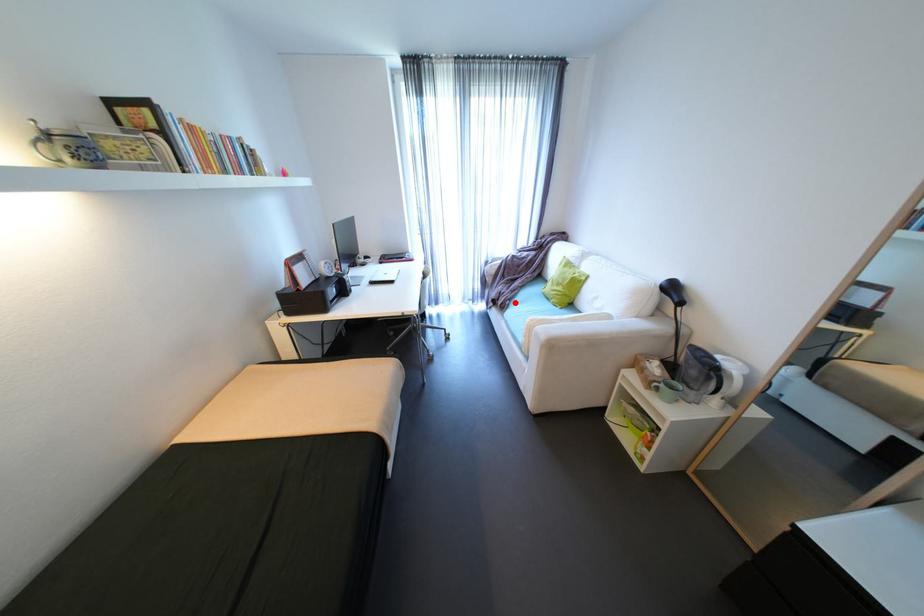
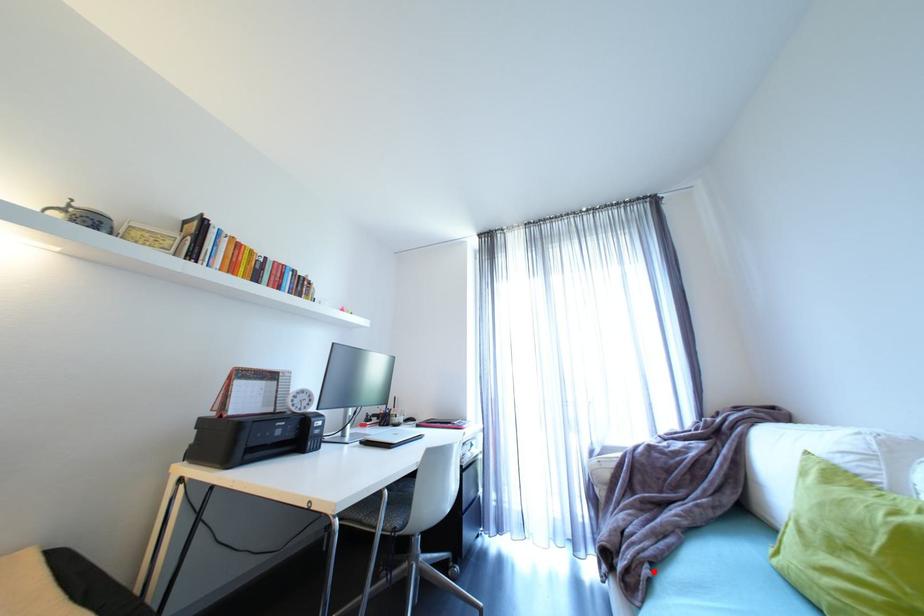
I am providing you with two images of the same scene from different viewpoints. A red point is marked on the first image and another point is marked on the second image. Are the points marked in image1 and image2 representing the same 3D position?

Yes